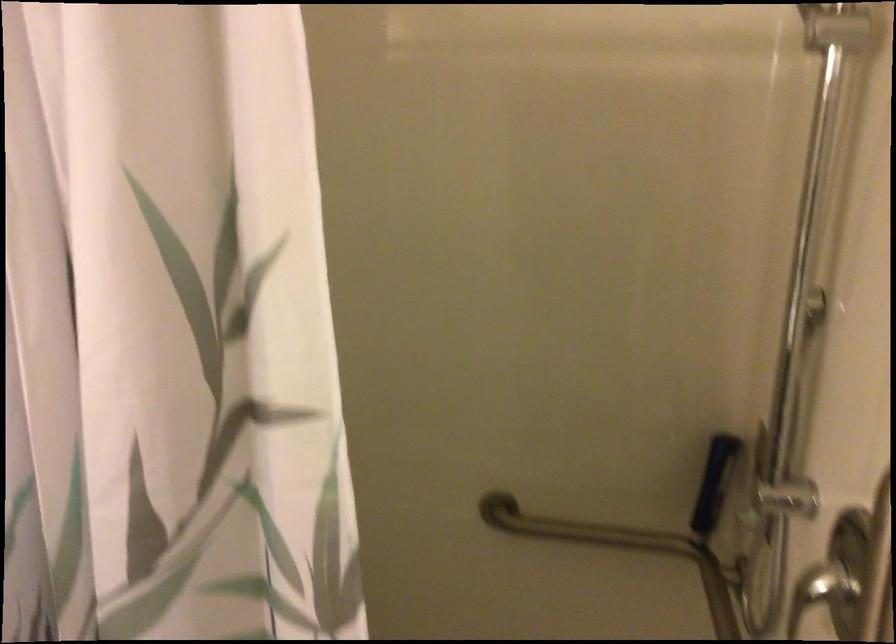
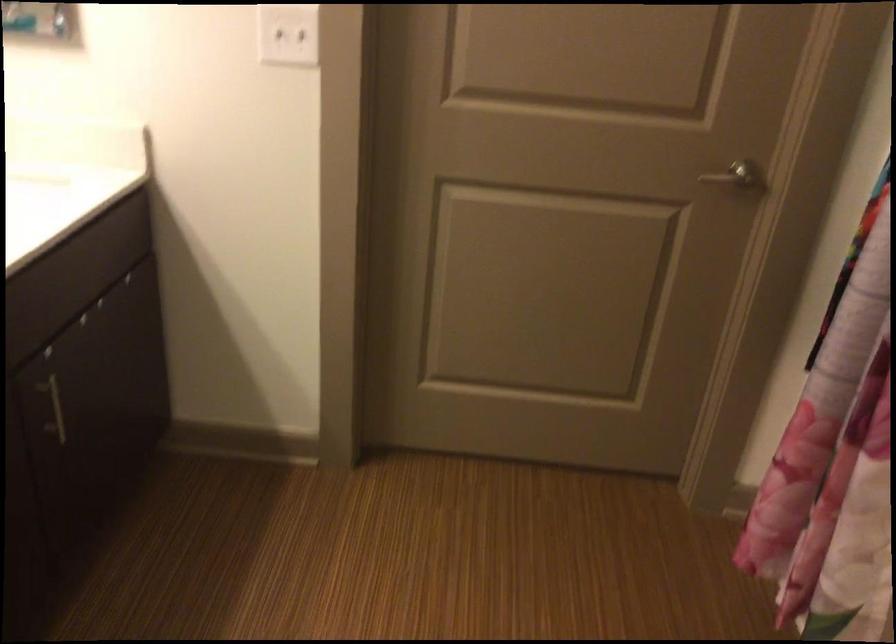
The images are taken continuously from a first-person perspective. In which direction is your viewpoint rotating?

The camera's rotation is toward left-down.